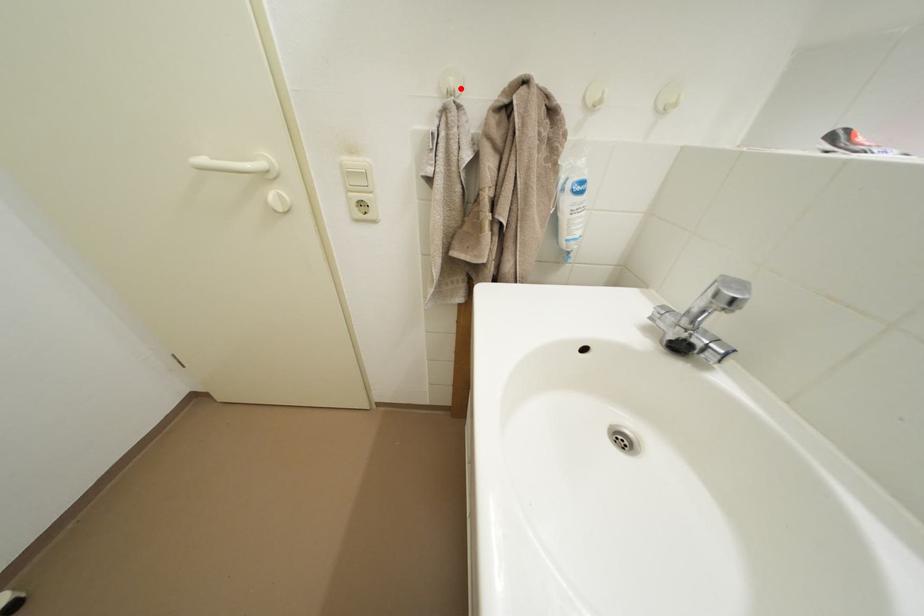
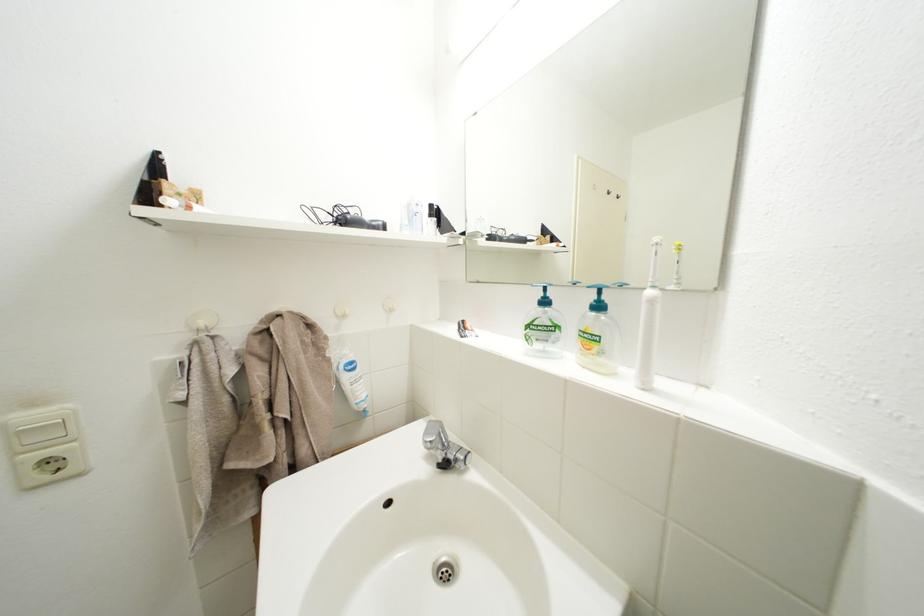
Where in the second image is the point corresponding to the highlighted location from the first image?

(211, 329)